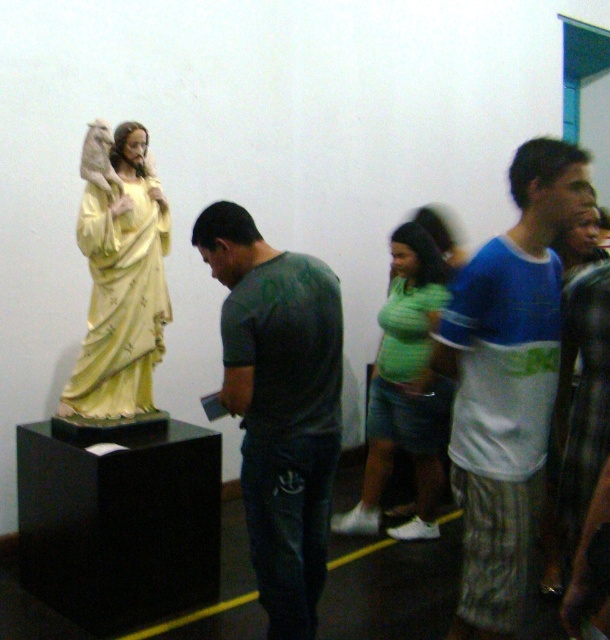
You are standing in the museum and want to take a photo of the statue. You notice two points marked in the image at coordinates point (x=315, y=291) and point (x=345, y=524). Which point is closer to your camera lens when aiming at the statue?

Point (x=315, y=291) is closer to the camera than point (x=345, y=524), so it would be closer to your camera lens when aiming at the statue.

Based on the photo, you are an art curator planning to rearrange the exhibit. The matte yellow statue at left and the green striped shirt at center are both part of the display. If you want to place them side by side, which object should be positioned on the left to maintain their current size relationship?

The matte yellow statue at left should be placed on the left since it is smaller than the green striped shirt at center, maintaining the size relationship where the smaller object is on the left.